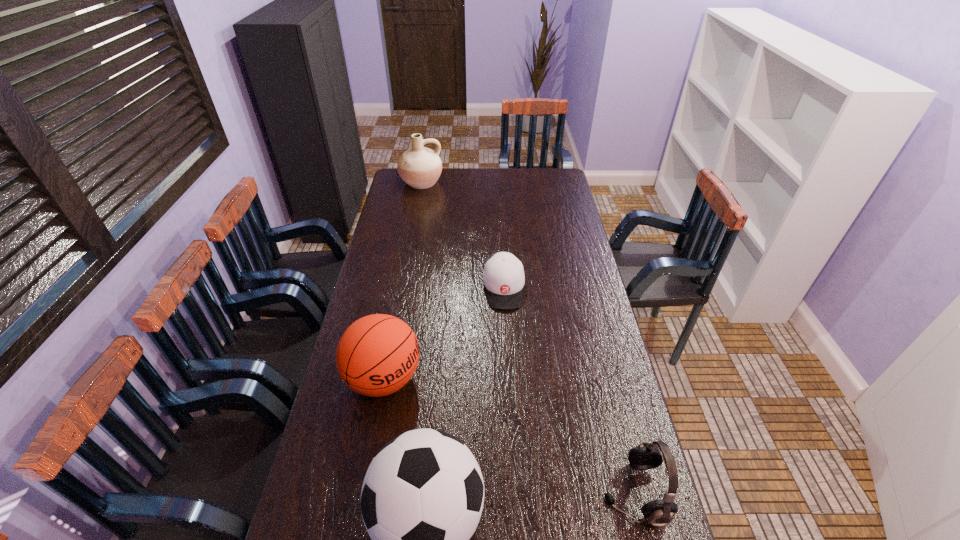
Locate an element on the screen. The height and width of the screenshot is (540, 960). the rightmost object is located at coordinates (646, 456).

The width and height of the screenshot is (960, 540). I want to click on the second shortest object, so click(646, 456).

The height and width of the screenshot is (540, 960). What are the coordinates of `basketball` in the screenshot? It's located at (377, 355).

Locate an element on the screen. pottery is located at coordinates (420, 167).

Where is `the shortest object`? the shortest object is located at coordinates (503, 277).

Identify the location of baseball cap. This screenshot has height=540, width=960. (503, 277).

Locate an element on the screen. vacant area situated with the microphone on the side of the second shortest object is located at coordinates tap(453, 493).

Identify the location of blank space located 0.080m with the microphone on the side of the second shortest object. The width and height of the screenshot is (960, 540). (572, 493).

The height and width of the screenshot is (540, 960). I want to click on vacant space located with the microphone on the side of the second shortest object, so 457,493.

Identify the location of vacant region located on the side with logo of the basketball. This screenshot has height=540, width=960. pos(468,436).